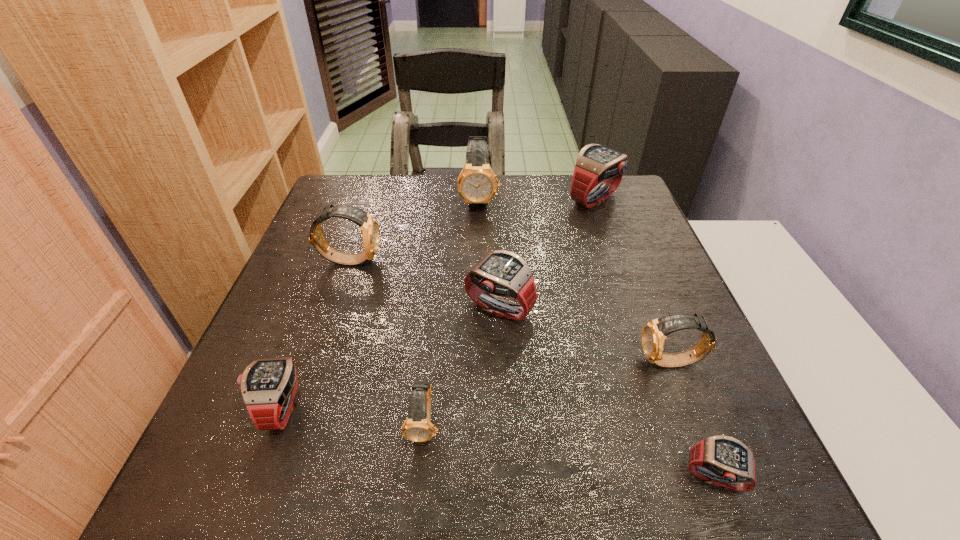
Locate an element on the screen. Image resolution: width=960 pixels, height=540 pixels. free space at the left edge of the desktop is located at coordinates (x=306, y=253).

This screenshot has height=540, width=960. Identify the location of free space at the right edge of the desktop. (636, 246).

Locate an element on the screen. This screenshot has height=540, width=960. unoccupied area between the biggest red watch and the tallest object is located at coordinates (537, 199).

This screenshot has width=960, height=540. What are the coordinates of `vacant region between the farthest red watch and the second smallest red watch` in the screenshot? It's located at (438, 303).

Find the location of `free spot between the third farthest red watch and the second red watch from left to right`. free spot between the third farthest red watch and the second red watch from left to right is located at coordinates (390, 358).

Where is `empty space that is in between the nearest red watch and the fifth nearest watch`? empty space that is in between the nearest red watch and the fifth nearest watch is located at coordinates (608, 394).

Identify the location of empty location between the second gold watch from right to left and the rightmost gold watch. (575, 281).

I want to click on unoccupied position between the shortest watch and the second farthest red watch, so click(x=608, y=394).

Identify the location of free spot between the third smallest red watch and the second gold watch from left to right. (462, 366).

Identify the location of free space that is in between the third nearest red watch and the biggest red watch. (547, 254).